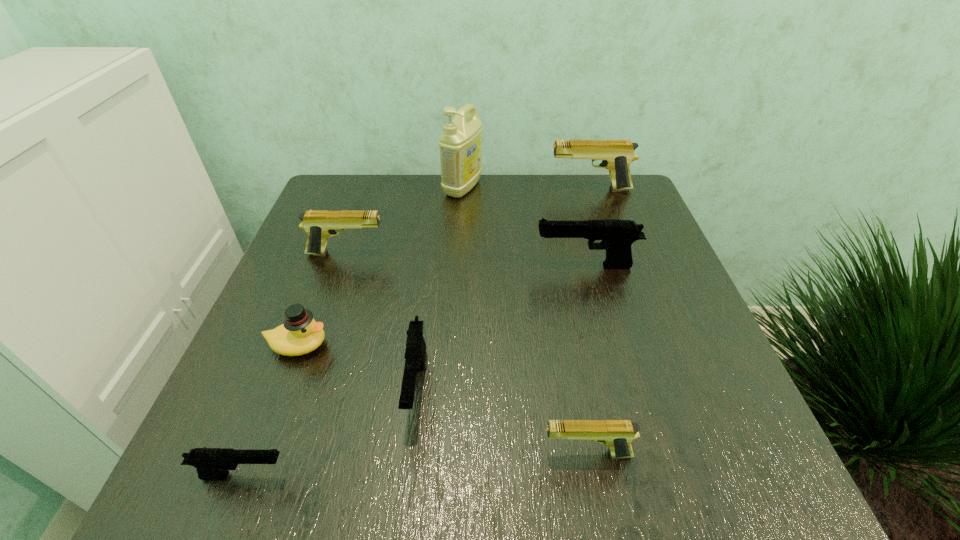
I want to click on vacant point located 0.190m on the front-facing side of the rightmost black pistol, so click(449, 266).

Where is `vacant position located on the front-facing side of the rightmost black pistol`? Image resolution: width=960 pixels, height=540 pixels. vacant position located on the front-facing side of the rightmost black pistol is located at coordinates (413, 266).

Where is `vacant space positioned at the barrel of the second nearest tan pistol`? This screenshot has width=960, height=540. vacant space positioned at the barrel of the second nearest tan pistol is located at coordinates (548, 253).

The height and width of the screenshot is (540, 960). What are the coordinates of `blank area located 0.240m on the front-facing side of the yellow duck` in the screenshot? It's located at (460, 345).

The width and height of the screenshot is (960, 540). Find the location of `vacant space located at the barrel of the fifth farthest pistol`. vacant space located at the barrel of the fifth farthest pistol is located at coordinates (316, 454).

At what (x,y) coordinates should I click in order to perform the action: click on vacant space situated 0.230m at the barrel of the fifth farthest pistol. Please return your answer as a coordinate pair (x, y). Looking at the image, I should click on (390, 454).

Image resolution: width=960 pixels, height=540 pixels. Find the location of `vacant space located 0.150m at the barrel of the fifth farthest pistol`. vacant space located 0.150m at the barrel of the fifth farthest pistol is located at coordinates (443, 454).

You are a GUI agent. You are given a task and a screenshot of the screen. Output one action in this format:
    pyautogui.click(x=<x>, y=<y>)
    Task: Click on the free space located on the front-facing side of the nearest object
    The image size is (960, 540).
    Given the screenshot: What is the action you would take?
    pyautogui.click(x=511, y=476)

This screenshot has width=960, height=540. I want to click on detergent situated at the far edge, so click(460, 144).

At what (x,y) coordinates should I click in order to perform the action: click on pistol located in the far edge section of the desktop. Please return your answer as a coordinate pair (x, y). Image resolution: width=960 pixels, height=540 pixels. Looking at the image, I should click on (616, 155).